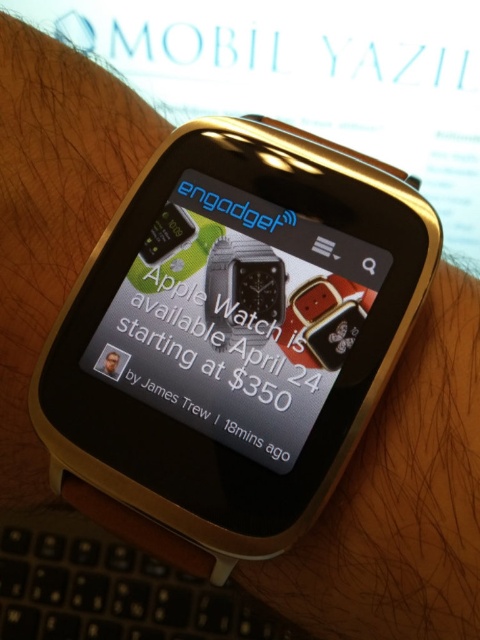
Can you confirm if gold metallic smartwatch at center is bigger than matte black smartwatch at center?

Correct, gold metallic smartwatch at center is larger in size than matte black smartwatch at center.

Does gold metallic smartwatch at center appear on the right side of matte black smartwatch at center?

Incorrect, gold metallic smartwatch at center is not on the right side of matte black smartwatch at center.

Who is more forward, (286, 525) or (312, 250)?

Positioned in front is point (286, 525).

The width and height of the screenshot is (480, 640). What are the coordinates of `gold metallic smartwatch at center` in the screenshot? It's located at (235, 333).

This screenshot has width=480, height=640. Find the location of `matte black smartwatch at center`. matte black smartwatch at center is located at coordinates (237, 317).

Which is in front, point (301, 419) or point (49, 612)?

Positioned in front is point (301, 419).

Find the location of a particular element. matte black smartwatch at center is located at coordinates (237, 317).

Is gold metallic smartwatch at center above black plastic keyboard at lower left?

Yes, gold metallic smartwatch at center is above black plastic keyboard at lower left.

Does point (193, 376) lie behind point (21, 541)?

No.

Identify the location of gold metallic smartwatch at center. (235, 333).